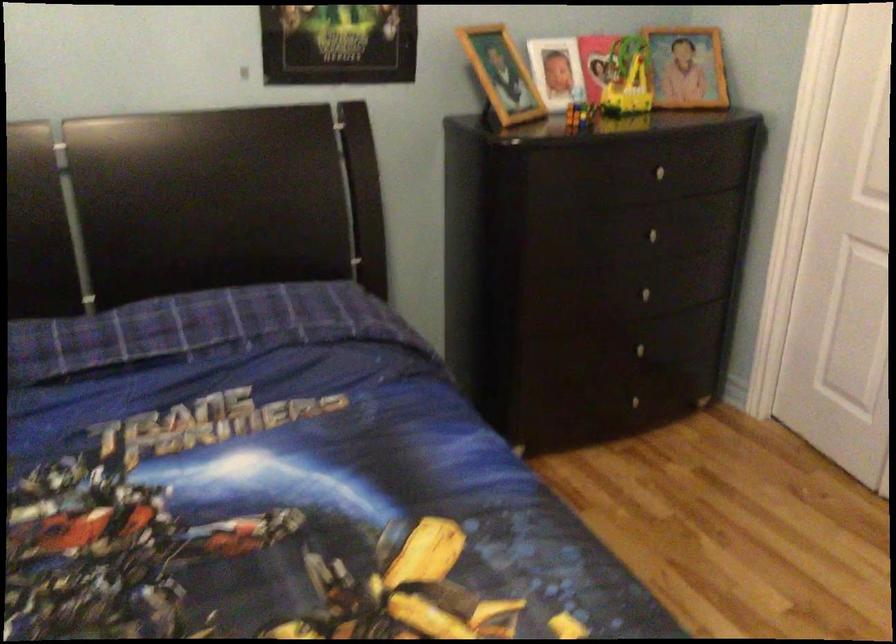
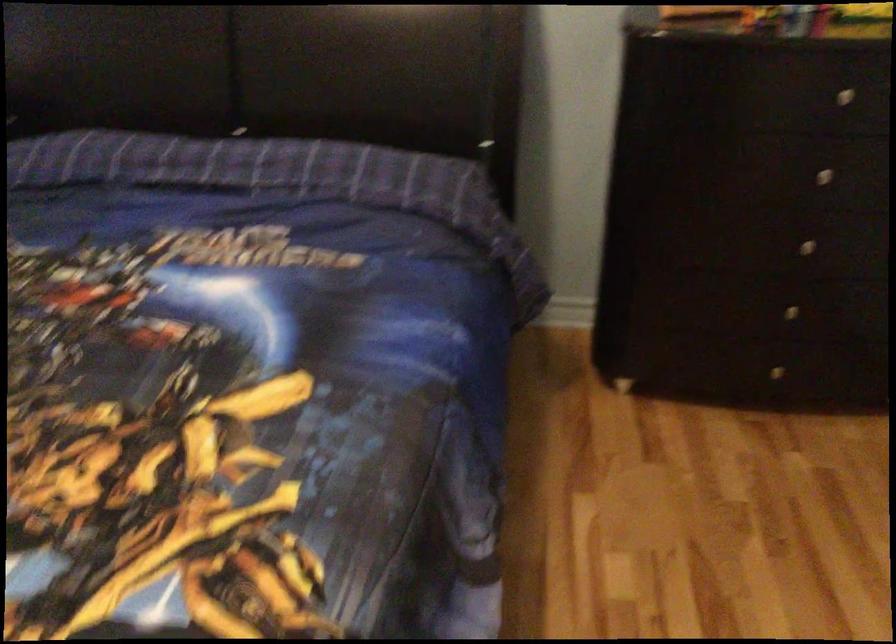
The point at (659, 228) is marked in the first image. Where is the corresponding point in the second image?

(833, 169)